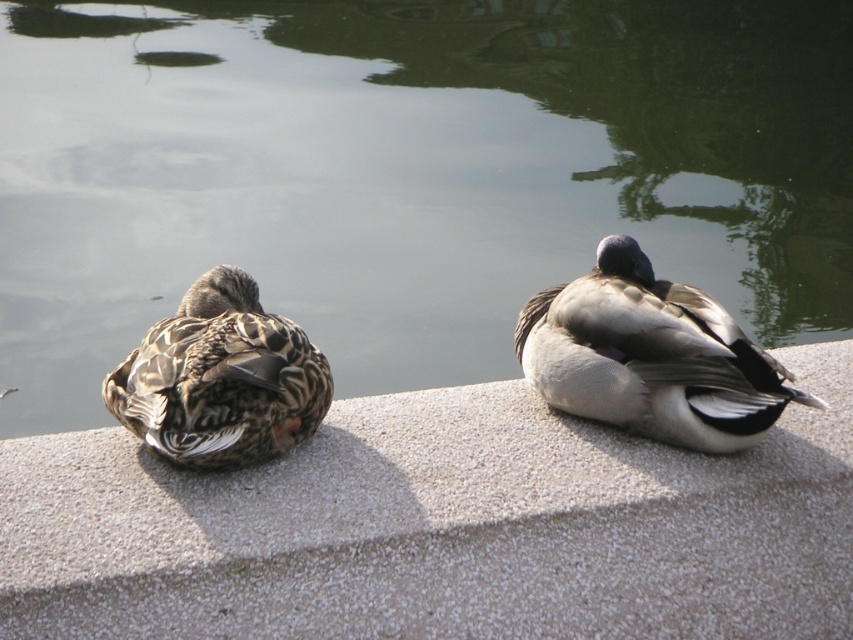
Question: Is green smooth water at center positioned behind camouflage feathered duck at left?

Choices:
 (A) yes
 (B) no

Answer: (A)

Question: Which of the following is the closest to the observer?

Choices:
 (A) gray textured concrete at center
 (B) gray matte duck at center
 (C) camouflage feathered duck at left

Answer: (A)

Question: Does gray textured concrete at center appear under gray matte duck at center?

Choices:
 (A) no
 (B) yes

Answer: (B)

Question: Considering the real-world distances, which object is closest to the gray textured concrete at center?

Choices:
 (A) camouflage feathered duck at left
 (B) green smooth water at center

Answer: (A)

Question: Does green smooth water at center appear on the left side of camouflage feathered duck at left?

Choices:
 (A) no
 (B) yes

Answer: (B)

Question: Which of the following is the closest to the observer?

Choices:
 (A) (149, 364)
 (B) (42, 108)
 (C) (646, 269)
 (D) (202, 612)

Answer: (D)